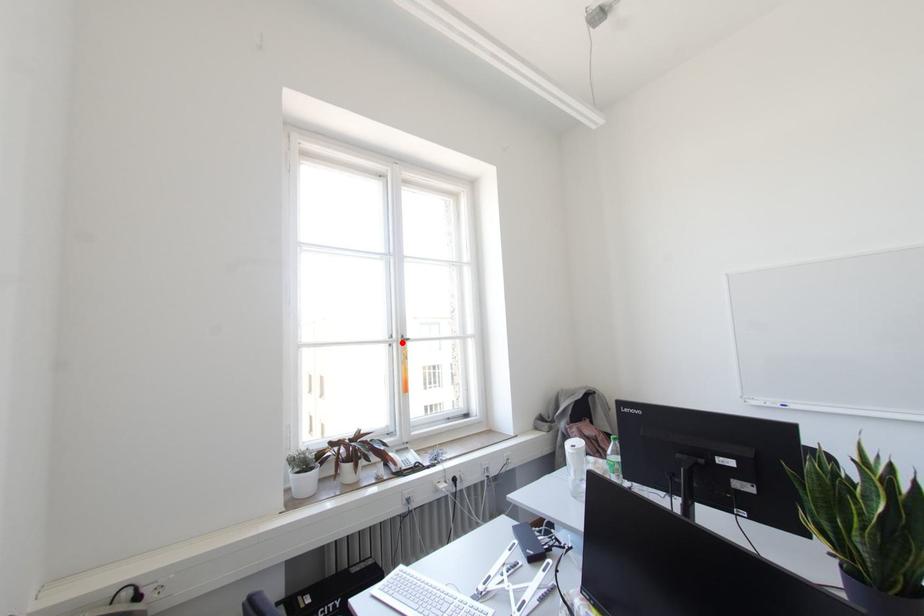
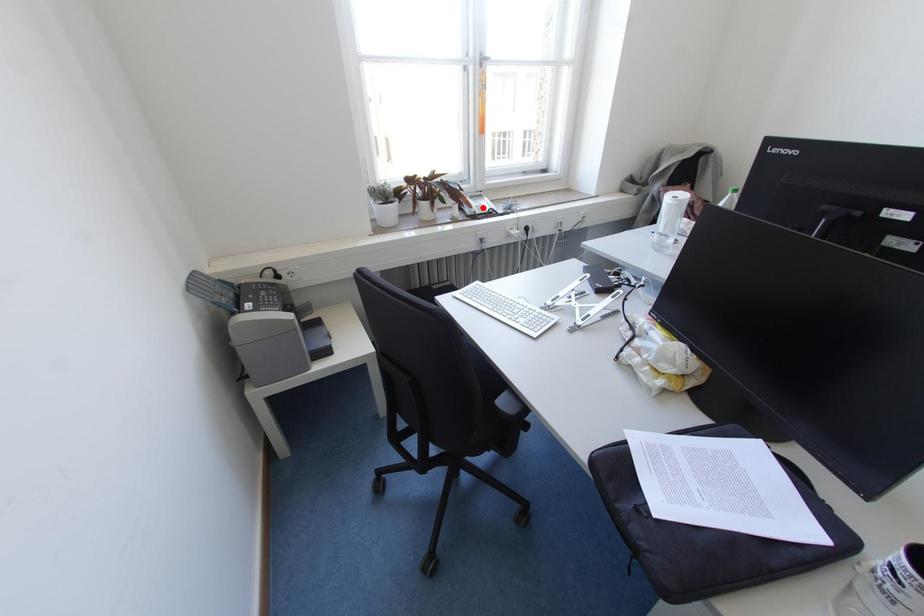
I am providing you with two images of the same scene from different viewpoints. A red point is marked on the first image and another point is marked on the second image. Does the point marked in image1 correspond to the same location as the one in image2?

No